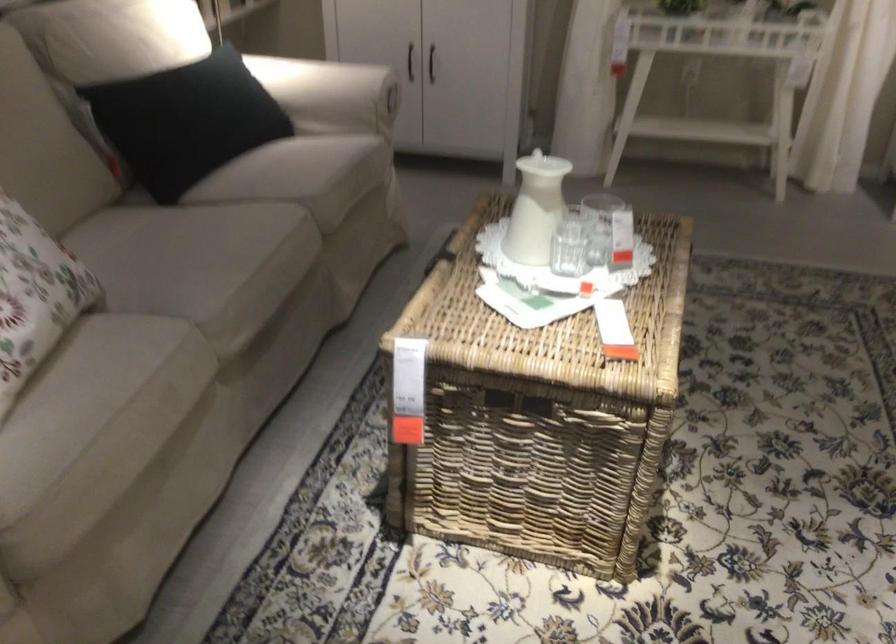
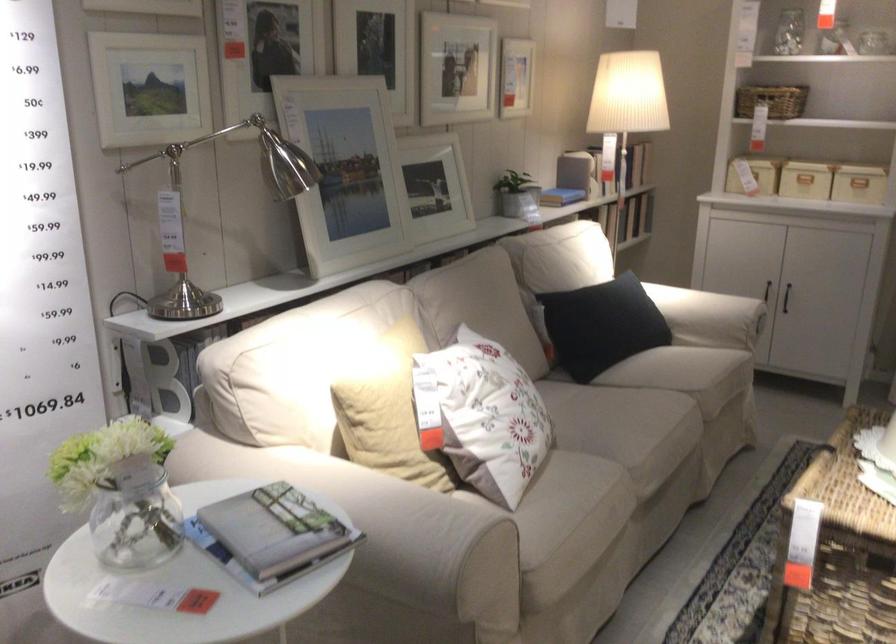
Locate, in the second image, the point that corresponds to pixel 438 393 in the first image.

(839, 552)